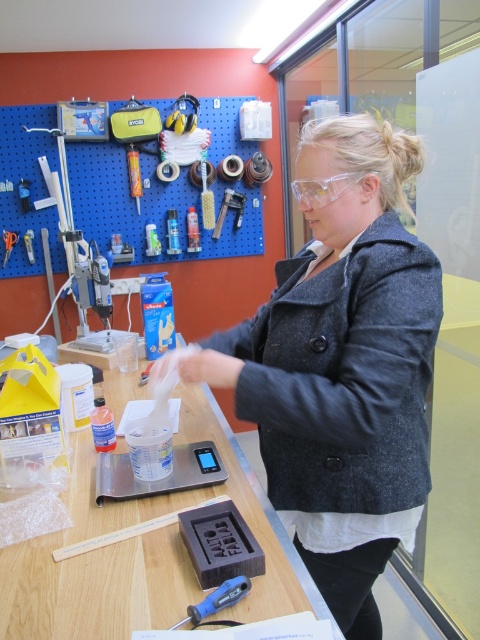
Question: Considering the real-world distances, which object is closest to the metallic silver scale at center?

Choices:
 (A) brushed metal scissors at upper left
 (B) wooden table at center

Answer: (B)

Question: Is metallic silver scale at center below brushed metal scissors at upper left?

Choices:
 (A) yes
 (B) no

Answer: (A)

Question: Which of the following is the closest to the observer?

Choices:
 (A) wooden table at center
 (B) brushed metal screwdriver at center
 (C) blue plastic screwdriver at lower center
 (D) metallic screwdriver at upper center

Answer: (A)

Question: Is gray woolen coat at center wider than brushed metal screwdriver at center?

Choices:
 (A) no
 (B) yes

Answer: (B)

Question: Is transparent plastic goggles at center positioned behind brushed metal scissors at upper left?

Choices:
 (A) no
 (B) yes

Answer: (A)

Question: Which object appears closest to the camera in this image?

Choices:
 (A) blue plastic screwdriver at lower center
 (B) metallic screwdriver at upper center

Answer: (A)